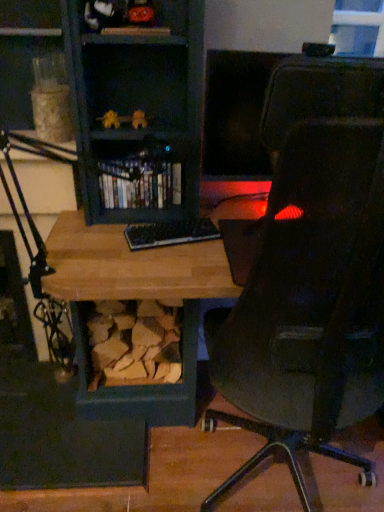
Question: From a real-world perspective, is transparent glass window at upper right beneath black plastic keyboard at center?

Choices:
 (A) yes
 (B) no

Answer: (B)

Question: Considering the relative sizes of transparent glass window at upper right and black plastic keyboard at center in the image provided, is transparent glass window at upper right shorter than black plastic keyboard at center?

Choices:
 (A) yes
 (B) no

Answer: (B)

Question: Considering the relative positions of transparent glass window at upper right and black plastic keyboard at center in the image provided, is transparent glass window at upper right behind black plastic keyboard at center?

Choices:
 (A) yes
 (B) no

Answer: (A)

Question: Is transparent glass window at upper right surrounding black plastic keyboard at center?

Choices:
 (A) no
 (B) yes

Answer: (A)

Question: Could you tell me if transparent glass window at upper right is facing black plastic keyboard at center?

Choices:
 (A) yes
 (B) no

Answer: (B)

Question: From the image's perspective, is black plastic keyboard at center positioned above or below transparent glass window at upper right?

Choices:
 (A) above
 (B) below

Answer: (B)

Question: Visually, is black plastic keyboard at center positioned to the left or to the right of transparent glass window at upper right?

Choices:
 (A) left
 (B) right

Answer: (A)

Question: From a real-world perspective, is black plastic keyboard at center positioned above or below transparent glass window at upper right?

Choices:
 (A) above
 (B) below

Answer: (B)

Question: Is black plastic keyboard at center bigger or smaller than transparent glass window at upper right?

Choices:
 (A) big
 (B) small

Answer: (B)

Question: From a real-world perspective, relative to black plastic keyboard at center, is transparent glass window at upper right vertically above or below?

Choices:
 (A) below
 (B) above

Answer: (B)

Question: Considering the positions of transparent glass window at upper right and black plastic keyboard at center in the image, is transparent glass window at upper right wider or thinner than black plastic keyboard at center?

Choices:
 (A) thin
 (B) wide

Answer: (A)

Question: Would you say transparent glass window at upper right is to the left or to the right of black plastic keyboard at center in the picture?

Choices:
 (A) right
 (B) left

Answer: (A)

Question: Considering the positions of point (365, 16) and point (196, 220), is point (365, 16) closer or farther from the camera than point (196, 220)?

Choices:
 (A) closer
 (B) farther

Answer: (B)

Question: In the image, is transparent glass window at upper right positioned in front of or behind shiny plastic books at center?

Choices:
 (A) behind
 (B) front

Answer: (A)

Question: Would you say transparent glass window at upper right is inside or outside shiny plastic books at center?

Choices:
 (A) outside
 (B) inside

Answer: (A)